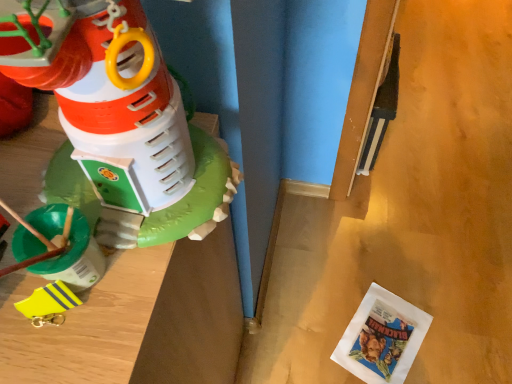
I want to click on vacant area situated to the left side of white paper comic book at lower right, so click(x=306, y=329).